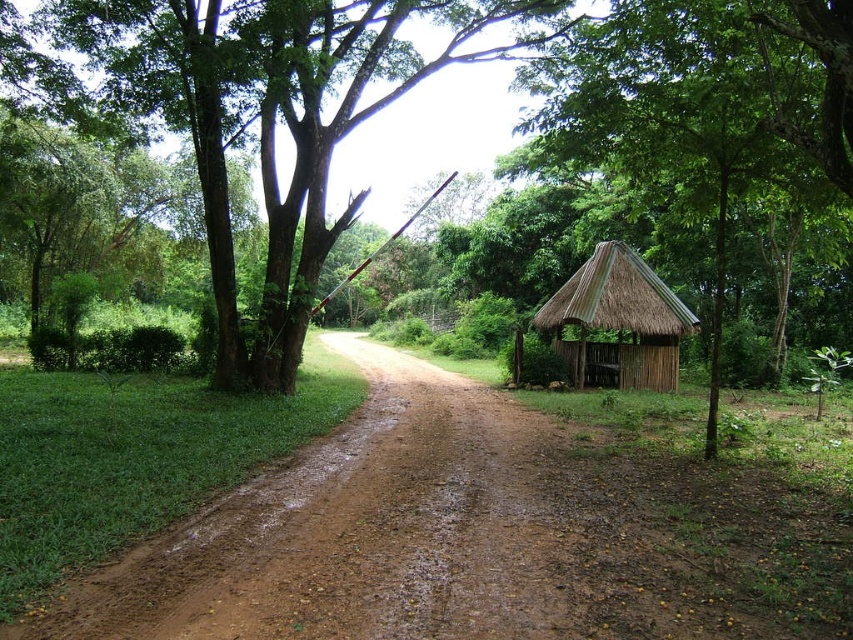
Is green thatch hut at right positioned at the back of thatched bamboo hut at right?

No, it is in front of thatched bamboo hut at right.

Consider the image. Does green thatch hut at right lie in front of thatched bamboo hut at right?

Yes, it is.

Between point (648, 64) and point (595, 348), which one is positioned behind?

The point (595, 348) is more distant.

In order to click on green thatch hut at right in this screenshot , I will do `click(706, 106)`.

Who is more distant from viewer, (x=798, y=552) or (x=827, y=188)?

The point (x=827, y=188) is more distant.

Is brown dirt track at center smaller than green thatch hut at right?

Indeed, brown dirt track at center has a smaller size compared to green thatch hut at right.

Which is in front, point (387, 570) or point (654, 109)?

Positioned in front is point (387, 570).

I want to click on brown dirt track at center, so click(495, 525).

Can you confirm if green leafy tree at center is bigger than green thatch hut at right?

Indeed, green leafy tree at center has a larger size compared to green thatch hut at right.

Between point (260, 321) and point (844, 96), which one is positioned in front?

Point (844, 96) is in front.

Is point (225, 100) positioned after point (688, 76)?

Yes, point (225, 100) is farther from viewer.

Find the location of a particular element. green leafy tree at center is located at coordinates (282, 115).